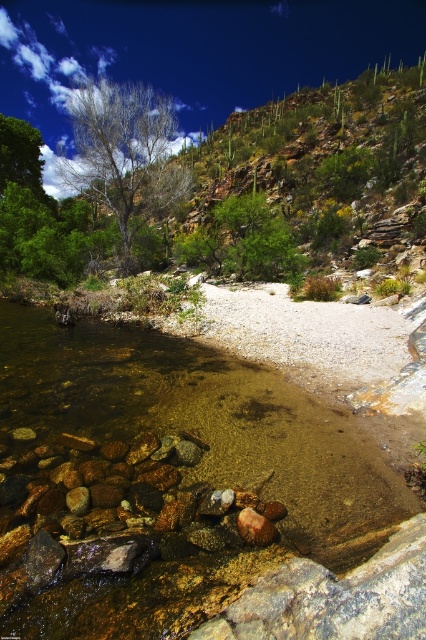
Which is in front, point (221, 424) or point (164, 144)?

Point (221, 424) is in front.

Between point (207, 525) and point (77, 113), which one is positioned in front?

Positioned in front is point (207, 525).

What are the coordinates of `translucent rock bed at lower left` in the screenshot? It's located at (184, 499).